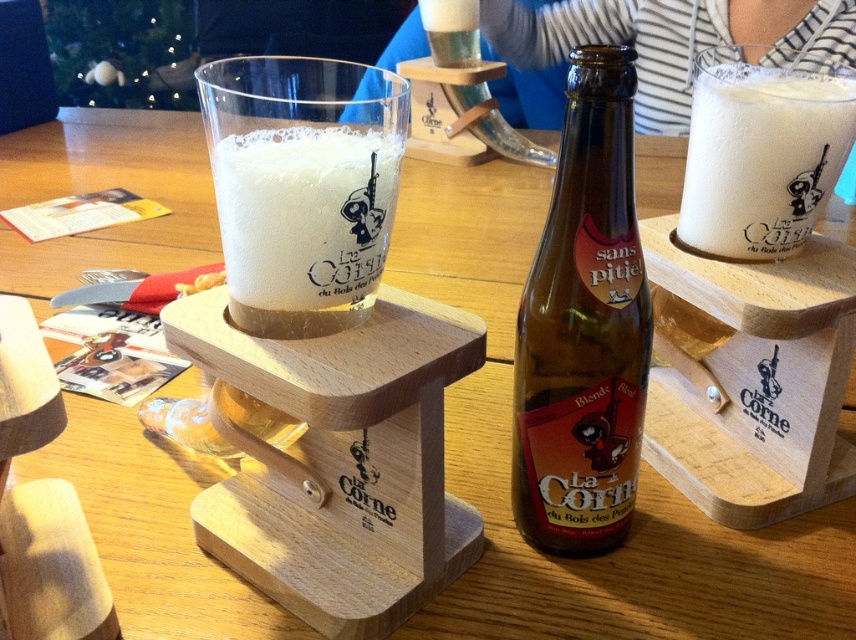
Between white frothy foam at center and white frothy foam at upper right, which one appears on the right side from the viewer's perspective?

white frothy foam at upper right

Based on the photo, who is positioned more to the left, white frothy foam at center or white frothy foam at upper right?

white frothy foam at center

Is point (277, 268) closer to camera compared to point (768, 170)?

Yes, point (277, 268) is closer to viewer.

The width and height of the screenshot is (856, 640). Find the location of `white frothy foam at center`. white frothy foam at center is located at coordinates (304, 225).

Does clear glass beer glass at center have a smaller size compared to striped fabric shirt at upper center?

Correct, clear glass beer glass at center occupies less space than striped fabric shirt at upper center.

Between clear glass beer glass at center and striped fabric shirt at upper center, which one appears on the right side from the viewer's perspective?

striped fabric shirt at upper center

Is point (397, 166) behind point (593, 29)?

No, (397, 166) is in front of (593, 29).

Image resolution: width=856 pixels, height=640 pixels. What are the coordinates of `clear glass beer glass at center` in the screenshot? It's located at (302, 186).

You are a GUI agent. You are given a task and a screenshot of the screen. Output one action in this format:
    pyautogui.click(x=<x>, y=<y>)
    Task: Click on the brown glass bottle at center
    The width and height of the screenshot is (856, 640).
    Given the screenshot: What is the action you would take?
    pyautogui.click(x=583, y=326)

Can you confirm if brown glass bottle at center is positioned below striped fabric shirt at upper center?

Indeed, brown glass bottle at center is positioned under striped fabric shirt at upper center.

Find the location of a particular element. The width and height of the screenshot is (856, 640). brown glass bottle at center is located at coordinates (583, 326).